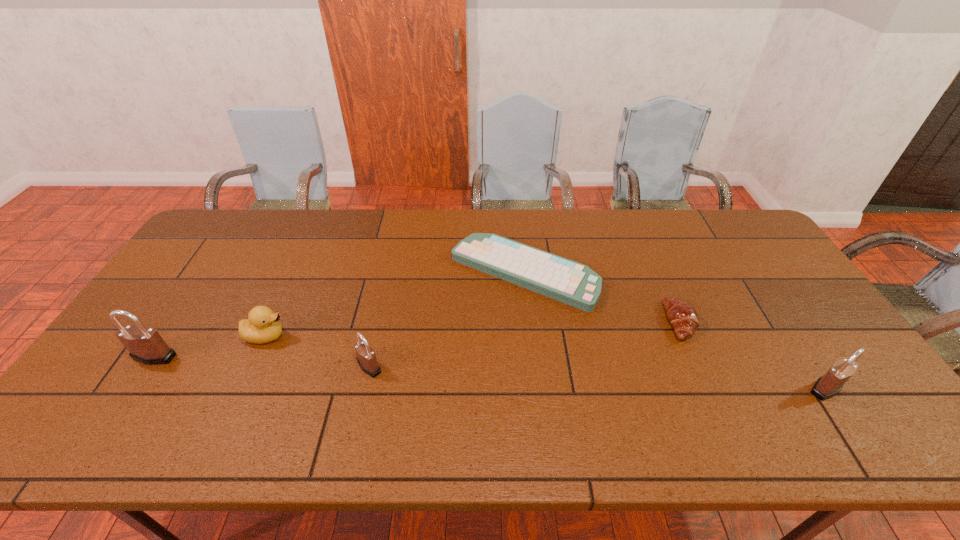
Image resolution: width=960 pixels, height=540 pixels. I want to click on object at the near right corner, so click(829, 385).

The height and width of the screenshot is (540, 960). What are the coordinates of `vacant space at the far edge` in the screenshot? It's located at (616, 246).

Locate an element on the screen. This screenshot has height=540, width=960. free location at the near edge is located at coordinates (467, 409).

This screenshot has height=540, width=960. In order to click on vacant region at the left edge of the desktop in this screenshot , I will do `click(204, 272)`.

Where is `free space at the right edge`? This screenshot has width=960, height=540. free space at the right edge is located at coordinates (728, 261).

This screenshot has width=960, height=540. In the image, there is a desktop. In order to click on vacant area at the far left corner in this screenshot , I will do `click(198, 244)`.

Where is `unoccupied position between the leftmost padlock and the second padlock from left to right`? This screenshot has width=960, height=540. unoccupied position between the leftmost padlock and the second padlock from left to right is located at coordinates (262, 361).

At what (x,y) coordinates should I click in order to perform the action: click on blank region between the third shortest object and the computer keyboard. Please return your answer as a coordinate pair (x, y). Looking at the image, I should click on (395, 304).

You are a GUI agent. You are given a task and a screenshot of the screen. Output one action in this format:
    pyautogui.click(x=<x>, y=<y>)
    Task: Click on the vacant area that lies between the duckling and the second tallest object
    The image size is (960, 540).
    Given the screenshot: What is the action you would take?
    pyautogui.click(x=546, y=362)

Find the location of a particular element. The height and width of the screenshot is (540, 960). free space between the shortest padlock and the rightmost padlock is located at coordinates (597, 377).